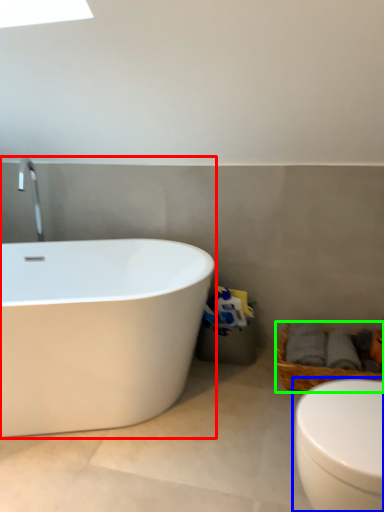
Question: Which is nearer to the bathtub (highlighted by a red box)? toilet (highlighted by a blue box) or basket (highlighted by a green box).

Choices:
 (A) toilet
 (B) basket

Answer: (B)